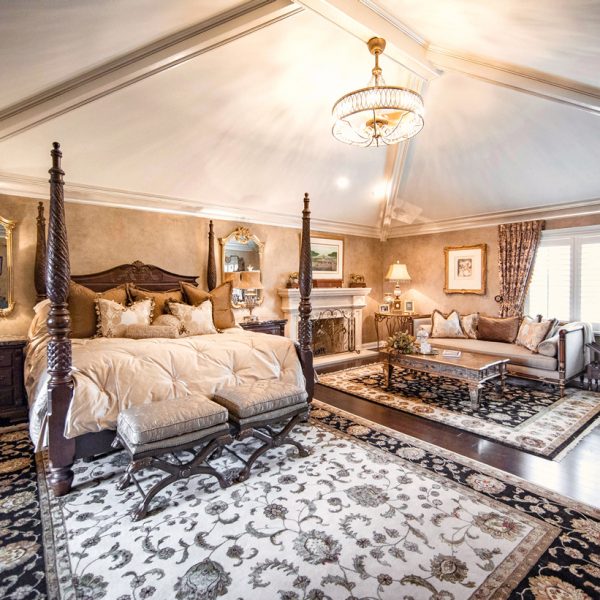
At what (x,y) coordinates should I click in order to perform the action: click on bed. Please return your answer as a coordinate pair (x, y). The image size is (600, 600). Looking at the image, I should click on (182, 386).